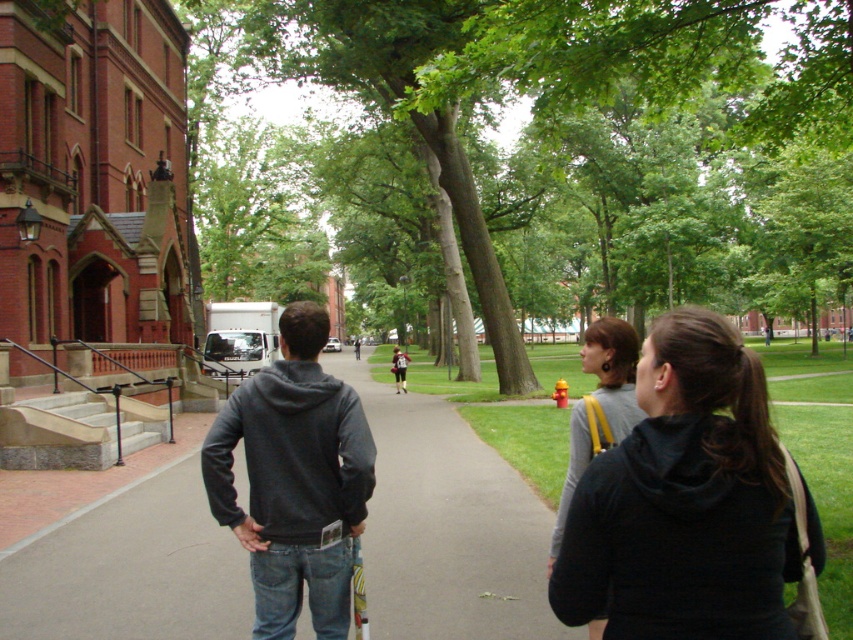
Who is more forward, (x=601, y=484) or (x=554, y=557)?

Point (x=601, y=484) is in front.

Who is higher up, gray hoodie at center or gray fabric backpack at center right?

gray hoodie at center is higher up.

The height and width of the screenshot is (640, 853). Identify the location of gray hoodie at center. (688, 500).

Where is `gray hoodie at center`? gray hoodie at center is located at coordinates (688, 500).

Locate an element on the screen. Image resolution: width=853 pixels, height=640 pixels. gray asphalt pavement at center is located at coordinates (447, 525).

Which of these two, gray asphalt pavement at center or dark gray hoodie at center, stands taller?

dark gray hoodie at center

Find the location of a particular element. This screenshot has height=640, width=853. gray asphalt pavement at center is located at coordinates point(447,525).

Where is `gray asphalt pavement at center`? This screenshot has width=853, height=640. gray asphalt pavement at center is located at coordinates (x=447, y=525).

Is gray asphalt pavement at center to the left of gray fabric backpack at center right from the viewer's perspective?

Indeed, gray asphalt pavement at center is positioned on the left side of gray fabric backpack at center right.

Describe the element at coordinates (447, 525) in the screenshot. I see `gray asphalt pavement at center` at that location.

Does point (115, 522) come in front of point (589, 406)?

No, (115, 522) is further to viewer.

You are a GUI agent. You are given a task and a screenshot of the screen. Output one action in this format:
    pyautogui.click(x=<x>, y=<y>)
    Task: Click on the gray asphalt pavement at center
    The height and width of the screenshot is (640, 853).
    Given the screenshot: What is the action you would take?
    pyautogui.click(x=447, y=525)